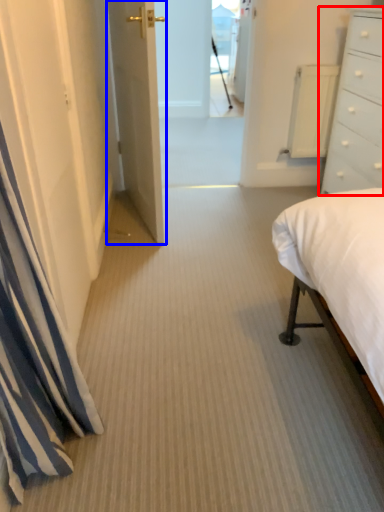
Question: Which of the following is the farthest to the observer, chest of drawers (highlighted by a red box) or door (highlighted by a blue box)?

Choices:
 (A) chest of drawers
 (B) door

Answer: (B)